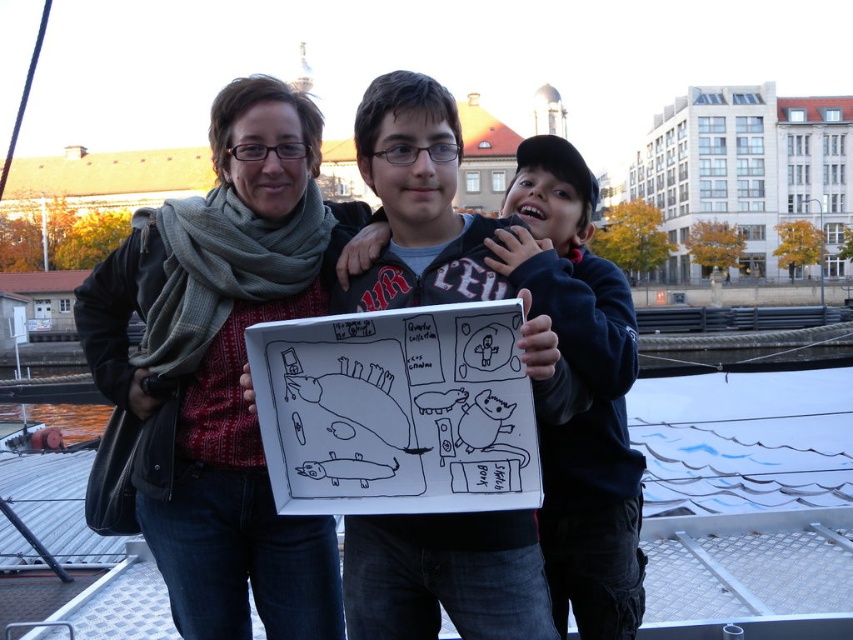
Question: Can you confirm if knitted scarf at center is thinner than matte black jacket at center?

Choices:
 (A) yes
 (B) no

Answer: (A)

Question: Does knitted scarf at center appear under matte black jacket at center?

Choices:
 (A) yes
 (B) no

Answer: (B)

Question: Does knitted scarf at center appear on the left side of matte black jacket at center?

Choices:
 (A) yes
 (B) no

Answer: (A)

Question: Among these objects, which one is farthest from the camera?

Choices:
 (A) knitted scarf at center
 (B) matte black jacket at center

Answer: (A)

Question: Which point is farther from the camera taking this photo?

Choices:
 (A) (248, 285)
 (B) (558, 440)

Answer: (B)